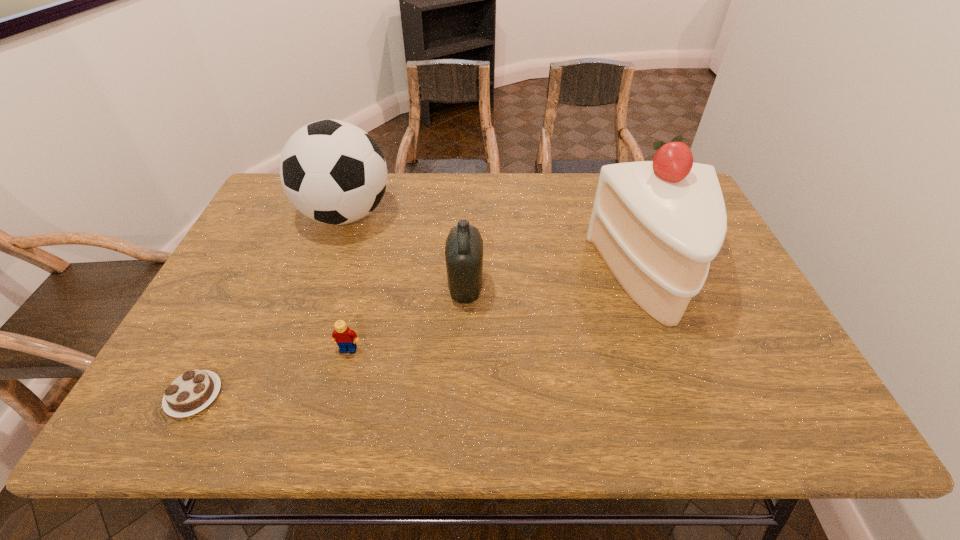
What are the coordinates of `vacant space at the far edge of the desktop` in the screenshot? It's located at (540, 194).

The height and width of the screenshot is (540, 960). I want to click on vacant region at the near edge of the desktop, so click(x=294, y=417).

This screenshot has height=540, width=960. In the image, there is a desktop. Identify the location of free space at the left edge. click(x=289, y=248).

This screenshot has height=540, width=960. What are the coordinates of `free space at the right edge of the desktop` in the screenshot? It's located at (757, 326).

Identify the location of vacant region between the bottle and the second nearest object. (407, 319).

You are a GUI agent. You are given a task and a screenshot of the screen. Output one action in this format:
    pyautogui.click(x=<x>, y=<y>)
    Task: Click on the empty space that is in between the chocolate cake and the cake
    The width and height of the screenshot is (960, 540).
    Given the screenshot: What is the action you would take?
    (422, 337)

Identify the location of free space that is in between the soccer ball and the chocolate cake. Image resolution: width=960 pixels, height=540 pixels. (270, 305).

I want to click on unoccupied position between the rightmost object and the fourth object from left to right, so click(559, 284).

Locate an element on the screen. Image resolution: width=960 pixels, height=540 pixels. vacant area between the second object from right to left and the cake is located at coordinates (559, 284).

Find the location of a particular element. The width and height of the screenshot is (960, 540). free space that is in between the fourth tallest object and the cake is located at coordinates coord(500,314).